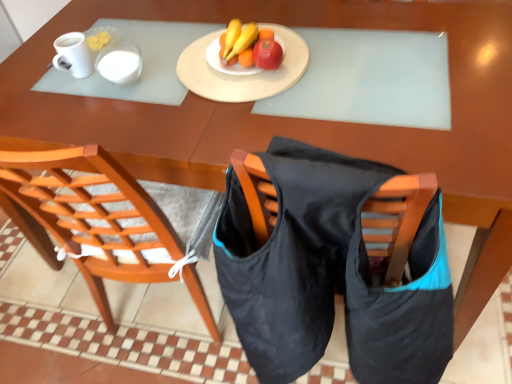
Question: Considering the relative sizes of matte yellow banana at center and white glossy mug at upper left in the image provided, is matte yellow banana at center thinner than white glossy mug at upper left?

Choices:
 (A) no
 (B) yes

Answer: (A)

Question: From a real-world perspective, is matte yellow banana at center beneath white glossy mug at upper left?

Choices:
 (A) yes
 (B) no

Answer: (A)

Question: Is white glossy mug at upper left completely or partially inside matte yellow banana at center?

Choices:
 (A) yes
 (B) no

Answer: (B)

Question: Is matte yellow banana at center next to white glossy mug at upper left?

Choices:
 (A) no
 (B) yes

Answer: (A)

Question: Is matte yellow banana at center facing towards white glossy mug at upper left?

Choices:
 (A) yes
 (B) no

Answer: (B)

Question: Considering the positions of wooden chair at center and white glossy mug at upper left in the image, is wooden chair at center bigger or smaller than white glossy mug at upper left?

Choices:
 (A) small
 (B) big

Answer: (B)

Question: In terms of height, does wooden chair at center look taller or shorter compared to white glossy mug at upper left?

Choices:
 (A) short
 (B) tall

Answer: (B)

Question: In terms of width, does wooden chair at center look wider or thinner when compared to white glossy mug at upper left?

Choices:
 (A) thin
 (B) wide

Answer: (B)

Question: Is wooden chair at center inside or outside of white glossy mug at upper left?

Choices:
 (A) inside
 (B) outside

Answer: (B)

Question: Is wooden chair at center inside or outside of white glossy mug at upper left?

Choices:
 (A) inside
 (B) outside

Answer: (B)

Question: Looking at the image, does wooden chair at center seem bigger or smaller compared to white glossy mug at upper left?

Choices:
 (A) small
 (B) big

Answer: (B)

Question: From the image's perspective, is wooden chair at center positioned above or below white glossy mug at upper left?

Choices:
 (A) above
 (B) below

Answer: (B)

Question: From a real-world perspective, is wooden chair at center above or below white glossy mug at upper left?

Choices:
 (A) above
 (B) below

Answer: (B)

Question: Is white glossy mug at upper left inside or outside of matte yellow banana at center?

Choices:
 (A) outside
 (B) inside

Answer: (A)

Question: From the image's perspective, is white glossy mug at upper left located above or below matte yellow banana at center?

Choices:
 (A) below
 (B) above

Answer: (A)